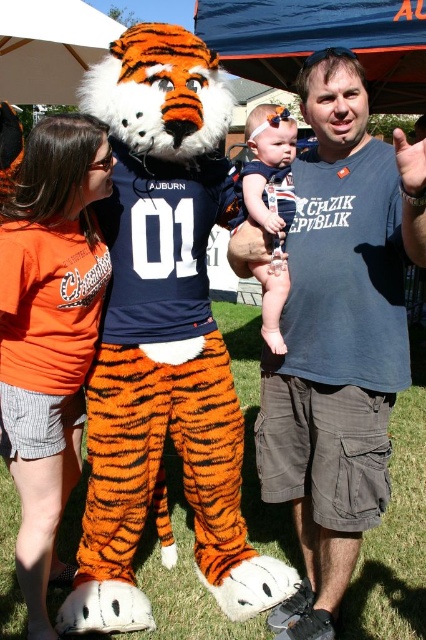
Question: Can you confirm if matte blue t-shirt at center is bigger than matte navy blue dress at center?

Choices:
 (A) yes
 (B) no

Answer: (A)

Question: Which point is closer to the camera taking this photo?

Choices:
 (A) (333, 131)
 (B) (267, 163)

Answer: (A)

Question: Among these objects, which one is nearest to the camera?

Choices:
 (A) matte navy blue dress at center
 (B) matte blue t-shirt at center

Answer: (B)

Question: Is matte blue t-shirt at center below matte navy blue dress at center?

Choices:
 (A) no
 (B) yes

Answer: (B)

Question: Can you confirm if matte blue t-shirt at center is smaller than matte navy blue dress at center?

Choices:
 (A) no
 (B) yes

Answer: (A)